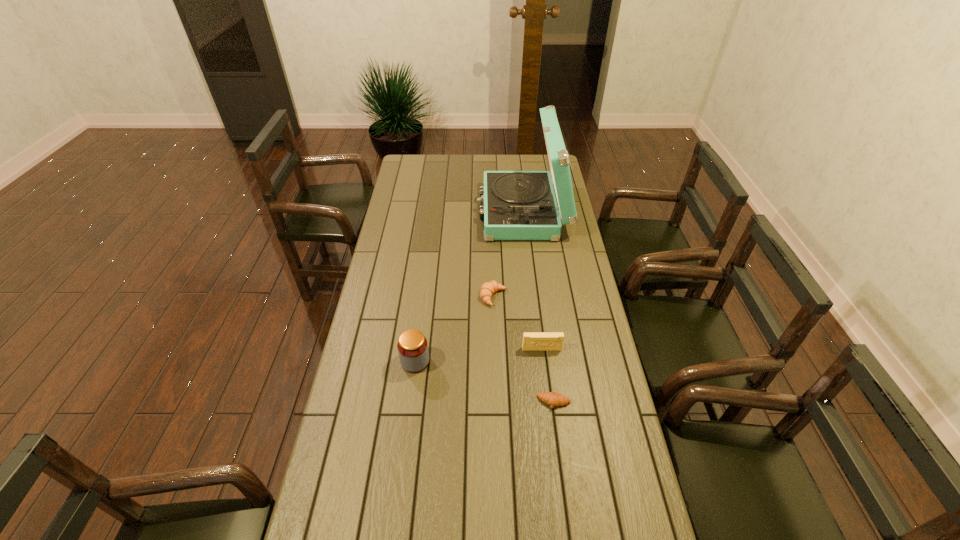
The image size is (960, 540). I want to click on vacant space positioned on the face side of the tallest object, so click(448, 212).

In order to click on blank space located 0.350m on the face side of the tallest object in this screenshot , I will do `click(403, 212)`.

What are the coordinates of `free spot located on the front of the jar` in the screenshot? It's located at (407, 428).

This screenshot has width=960, height=540. What are the coordinates of `free space located at the front of the videotape with spools` in the screenshot? It's located at (544, 366).

Where is `free spot located 0.280m on the front of the farther crescent roll`? Image resolution: width=960 pixels, height=540 pixels. free spot located 0.280m on the front of the farther crescent roll is located at coordinates (495, 372).

Locate an element on the screen. The height and width of the screenshot is (540, 960). free spot located on the left of the shorter crescent roll is located at coordinates (495, 402).

Image resolution: width=960 pixels, height=540 pixels. In order to click on object that is at the left edge in this screenshot , I will do `click(412, 346)`.

Where is `record player located at the right edge`? This screenshot has height=540, width=960. record player located at the right edge is located at coordinates (517, 205).

At what (x,y) coordinates should I click in order to perform the action: click on videotape that is positioned at the right edge. Please return your answer as a coordinate pair (x, y). Looking at the image, I should click on (532, 341).

Find the location of a particular element. The width and height of the screenshot is (960, 540). crescent roll positioned at the right edge is located at coordinates (553, 399).